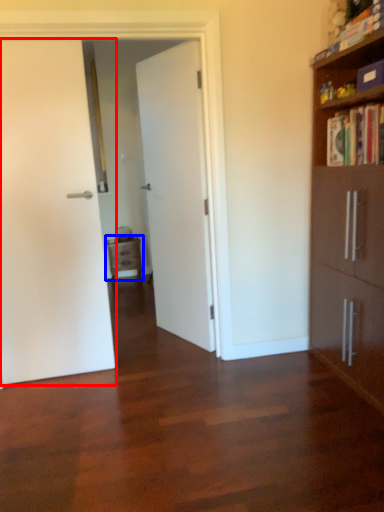
Question: Which of the following is the closest to the observer, door (highlighted by a red box) or nightstand (highlighted by a blue box)?

Choices:
 (A) door
 (B) nightstand

Answer: (A)